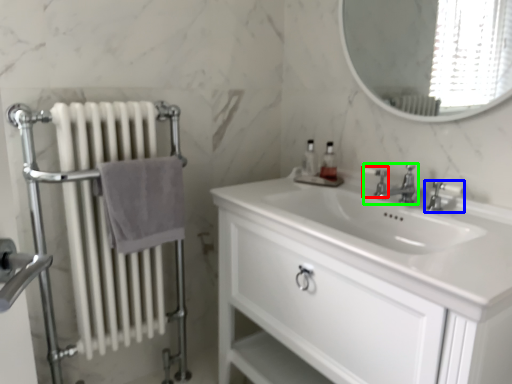
Question: Which object is the farthest from plumbing fixture (highlighted by a red box)? Choose among these: tap (highlighted by a blue box) or tap (highlighted by a green box).

Choices:
 (A) tap
 (B) tap

Answer: (A)